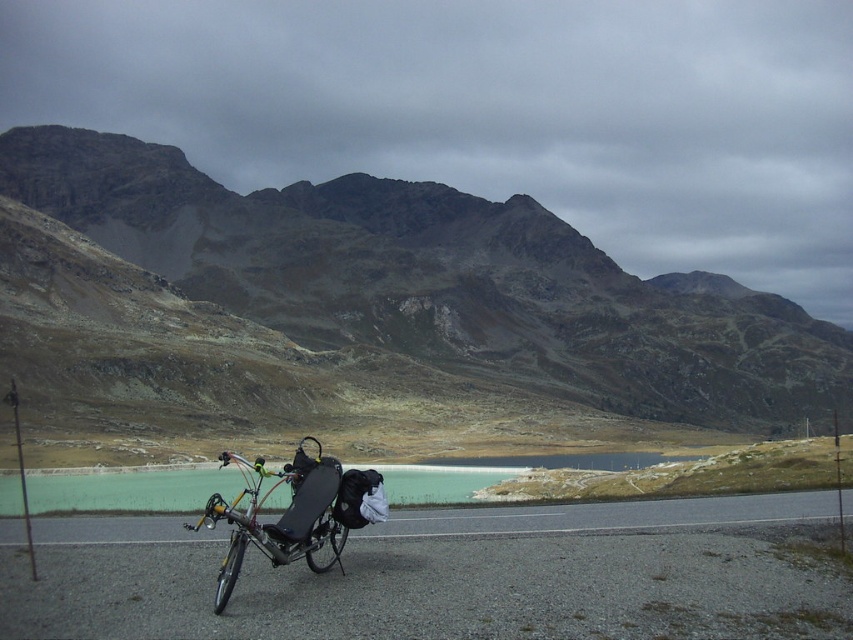
Question: Which object appears farthest from the camera in this image?

Choices:
 (A) matte black bicycle at center
 (B) green glassy water at center
 (C) rugged stone mountain at upper center

Answer: (C)

Question: Does green glassy water at center have a larger size compared to matte black bicycle at center?

Choices:
 (A) yes
 (B) no

Answer: (A)

Question: Which point appears farthest from the camera in this image?

Choices:
 (A) (229, 387)
 (B) (218, 586)

Answer: (A)

Question: Does rugged stone mountain at upper center appear over green glassy water at center?

Choices:
 (A) yes
 (B) no

Answer: (A)

Question: Does rugged stone mountain at upper center have a greater width compared to matte black bicycle at center?

Choices:
 (A) no
 (B) yes

Answer: (B)

Question: Which point is farther to the camera?

Choices:
 (A) (268, 556)
 (B) (143, 472)
 (C) (68, 221)

Answer: (C)